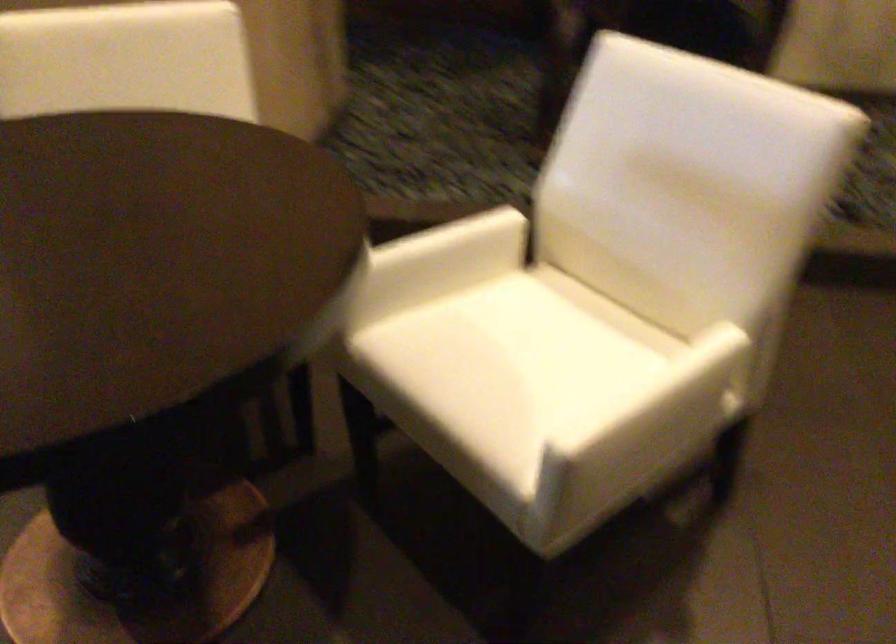
Find where to sit the white chair sitting surface. Please return your answer as a coordinate pair (x, y).

(533, 348)